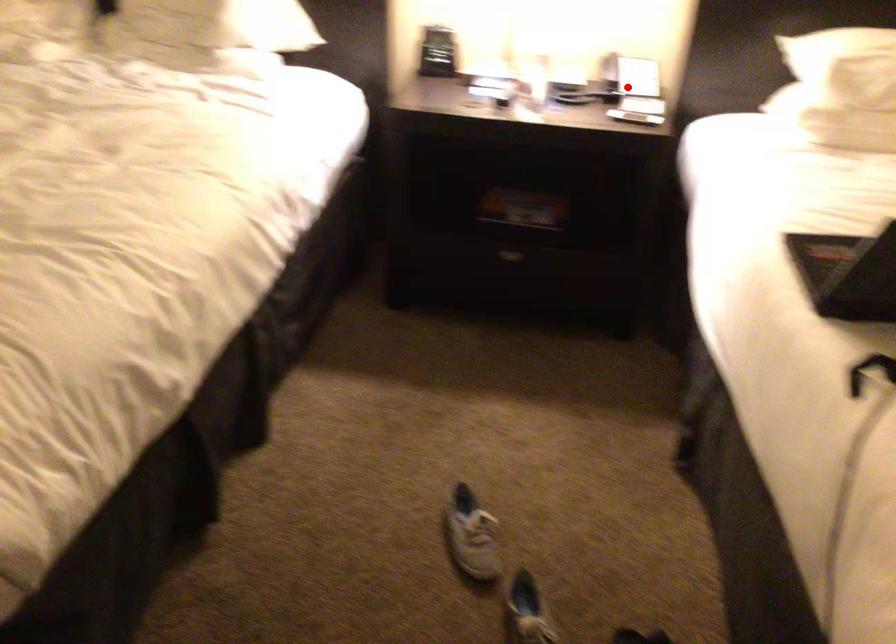
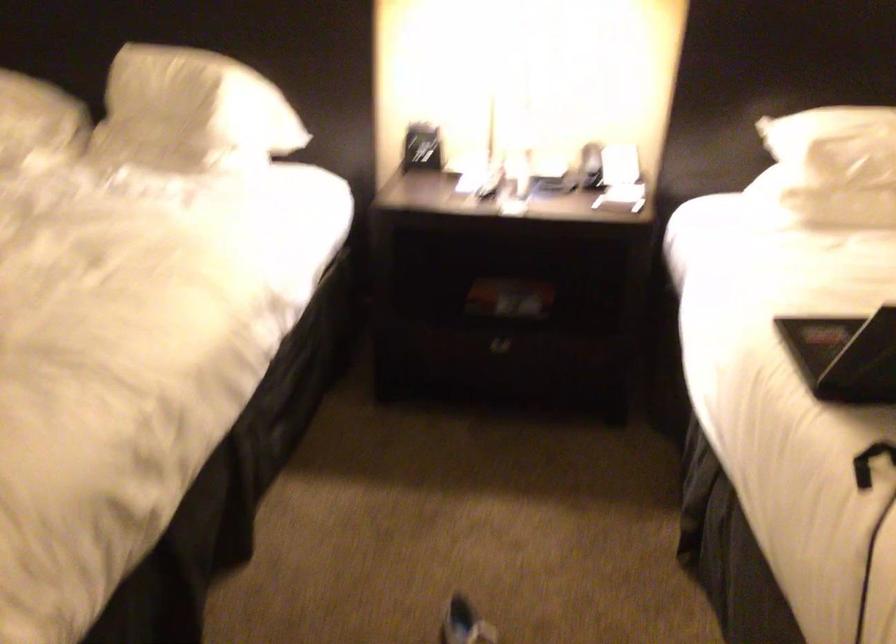
Find the pixel in the second image that matches the highlighted location in the first image.

(609, 176)